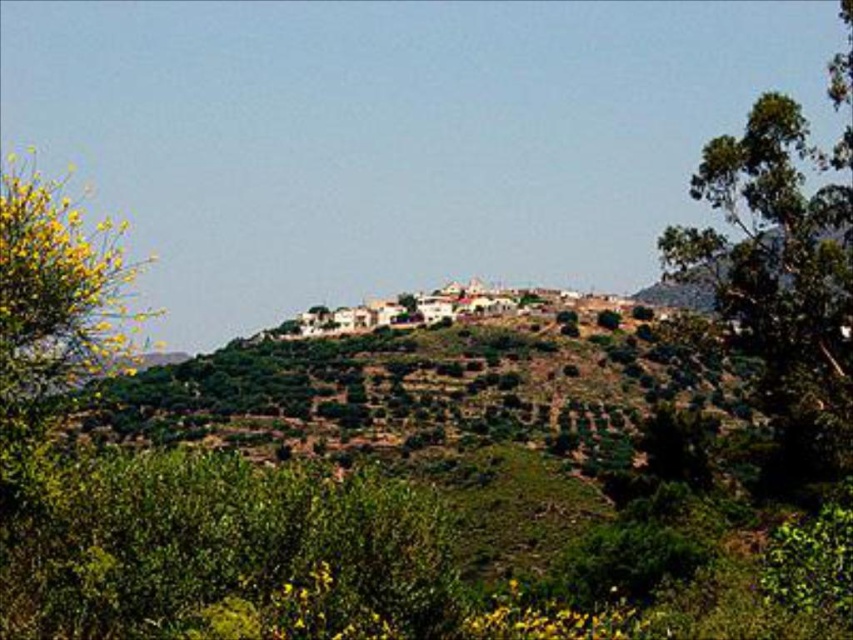
You are standing at the base of the hill and looking up at the hillside landscape. There are two points marked on the image, one at coordinate point (x=730, y=173) and another at point (x=73, y=349). Which point is closer to your eyes?

Point (x=730, y=173) is further to the camera than point (x=73, y=349), so the point closer to your eyes is point (x=73, y=349).